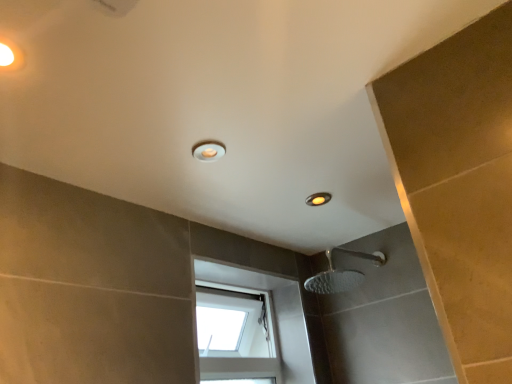
Question: Can you confirm if matte white light fixture at upper center is positioned to the right of transparent glass window at center?

Choices:
 (A) yes
 (B) no

Answer: (B)

Question: From a real-world perspective, is matte white light fixture at upper center located beneath transparent glass window at center?

Choices:
 (A) no
 (B) yes

Answer: (A)

Question: Does matte white light fixture at upper center have a greater height compared to transparent glass window at center?

Choices:
 (A) no
 (B) yes

Answer: (A)

Question: Is matte white light fixture at upper center far away from transparent glass window at center?

Choices:
 (A) no
 (B) yes

Answer: (A)

Question: Is matte white light fixture at upper center positioned before transparent glass window at center?

Choices:
 (A) no
 (B) yes

Answer: (B)

Question: Could you tell me if matte white light fixture at upper center is turned towards transparent glass window at center?

Choices:
 (A) no
 (B) yes

Answer: (A)

Question: Is transparent glass window at center aimed at matte white light fixture at upper center?

Choices:
 (A) yes
 (B) no

Answer: (B)

Question: Is transparent glass window at center wider than matte white light fixture at upper center?

Choices:
 (A) no
 (B) yes

Answer: (B)

Question: Is transparent glass window at center next to matte white light fixture at upper center?

Choices:
 (A) no
 (B) yes

Answer: (A)

Question: Can you confirm if transparent glass window at center is taller than matte white light fixture at upper center?

Choices:
 (A) no
 (B) yes

Answer: (B)

Question: Is transparent glass window at center behind matte white light fixture at upper center?

Choices:
 (A) yes
 (B) no

Answer: (A)

Question: Considering the relative positions of transparent glass window at center and matte white light fixture at upper center in the image provided, is transparent glass window at center to the left of matte white light fixture at upper center from the viewer's perspective?

Choices:
 (A) no
 (B) yes

Answer: (A)

Question: Is transparent glass window at center inside the boundaries of matte white light fixture at upper center, or outside?

Choices:
 (A) outside
 (B) inside

Answer: (A)